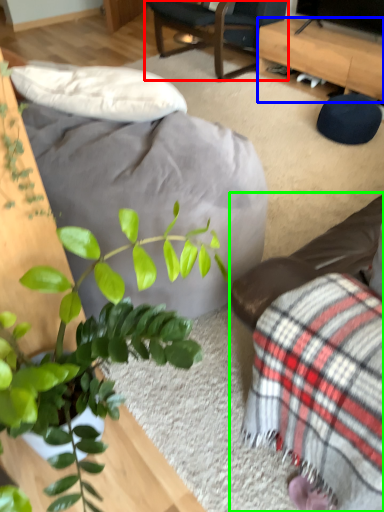
Question: Considering the real-world distances, which object is farthest from chair (highlighted by a red box)? desk (highlighted by a blue box) or studio couch (highlighted by a green box)?

Choices:
 (A) desk
 (B) studio couch

Answer: (B)